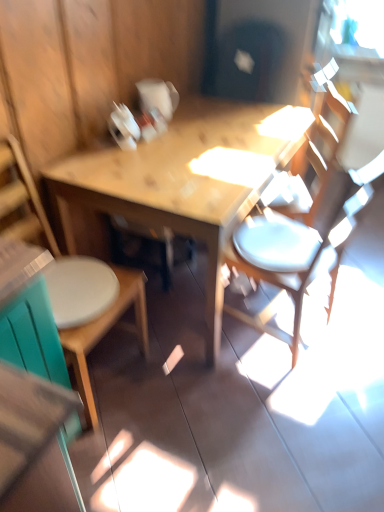
Identify the location of white matte chair at right, which ranks as the 2th chair in left-to-right order. (302, 249).

Locate an element on the screen. wooden chair at left, the second chair when ordered from right to left is located at coordinates (105, 333).

Locate an element on the screen. white matte chair at right, placed as the 1th chair when sorted from right to left is located at coordinates (302, 249).

From the image's perspective, who appears lower, wooden table at center or wooden chair at left, which is counted as the first chair, starting from the left?

wooden chair at left, which is counted as the first chair, starting from the left, is shown below in the image.

Is wooden table at center touching wooden chair at left, which is counted as the first chair, starting from the left?

They are not placed beside each other.

From the picture: Is wooden table at center in front of wooden chair at left, which is counted as the first chair, starting from the left?

No, wooden table at center is further to the viewer.

Based on the photo, is wooden table at center positioned with its back to wooden chair at left, which is counted as the first chair, starting from the left?

No.

Is white matte chair at right, which ranks as the 2th chair in left-to-right order, wider or thinner than wooden chair at left, which is counted as the first chair, starting from the left?

white matte chair at right, which ranks as the 2th chair in left-to-right order, is wider than wooden chair at left, which is counted as the first chair, starting from the left.

Would you consider white matte chair at right, which ranks as the 2th chair in left-to-right order, to be distant from wooden chair at left, the second chair when ordered from right to left?

No.

From a real-world perspective, is white matte chair at right, which ranks as the 2th chair in left-to-right order, physically above wooden chair at left, the second chair when ordered from right to left?

Incorrect, from a real-world perspective, white matte chair at right, which ranks as the 2th chair in left-to-right order, is lower than wooden chair at left, the second chair when ordered from right to left.

Is white matte chair at right, placed as the 1th chair when sorted from right to left, bigger than wooden chair at left, the second chair when ordered from right to left?

Yes.

In terms of width, does wooden chair at left, the second chair when ordered from right to left, look wider or thinner when compared to white matte chair at right, which ranks as the 2th chair in left-to-right order?

In the image, wooden chair at left, the second chair when ordered from right to left, appears to be more narrow than white matte chair at right, which ranks as the 2th chair in left-to-right order.

Is wooden chair at left, which is counted as the first chair, starting from the left, turned away from white matte chair at right, placed as the 1th chair when sorted from right to left?

No, wooden chair at left, which is counted as the first chair, starting from the left, is not facing away from white matte chair at right, placed as the 1th chair when sorted from right to left.

Find the location of a particular element. This screenshot has width=384, height=512. chair in front of the white matte chair at right, which ranks as the 2th chair in left-to-right order is located at coordinates (105, 333).

Considering the positions of points (88, 392) and (234, 168), is point (88, 392) farther from camera compared to point (234, 168)?

No.

Could you tell me if wooden chair at left, the second chair when ordered from right to left, is facing wooden table at center?

No, wooden chair at left, the second chair when ordered from right to left, is not turned towards wooden table at center.

How much distance is there between wooden chair at left, the second chair when ordered from right to left, and wooden table at center?

The distance of wooden chair at left, the second chair when ordered from right to left, from wooden table at center is 54.15 centimeters.

From a real-world perspective, count 2nd chairs upward from the wooden table at center and point to it. Please provide its 2D coordinates.

[(105, 333)]

From a real-world perspective, which object rests below the other?

wooden table at center, from a real-world perspective.

Do you think white matte chair at right, placed as the 1th chair when sorted from right to left, is within wooden table at center, or outside of it?

white matte chair at right, placed as the 1th chair when sorted from right to left, lies outside wooden table at center.

How many degrees apart are the facing directions of white matte chair at right, placed as the 1th chair when sorted from right to left, and wooden table at center?

167 degrees separate the facing orientations of white matte chair at right, placed as the 1th chair when sorted from right to left, and wooden table at center.

What are the coordinates of `table that appears behind the white matte chair at right, placed as the 1th chair when sorted from right to left` in the screenshot? It's located at (187, 180).

Would you say wooden table at center is to the left or to the right of white matte chair at right, which ranks as the 2th chair in left-to-right order, in the picture?

From the image, it's evident that wooden table at center is to the left of white matte chair at right, which ranks as the 2th chair in left-to-right order.

Which is closer to the camera, (x=213, y=298) or (x=320, y=205)?

Point (x=213, y=298) appears to be closer to the viewer than point (x=320, y=205).

From a real-world perspective, is wooden table at center physically below white matte chair at right, placed as the 1th chair when sorted from right to left?

Correct, in the physical world, wooden table at center is lower than white matte chair at right, placed as the 1th chair when sorted from right to left.

Is wooden table at center oriented away from white matte chair at right, placed as the 1th chair when sorted from right to left?

No.

Locate an element on the screen. table that is behind the wooden chair at left, which is counted as the first chair, starting from the left is located at coordinates (187, 180).

Locate an element on the screen. chair above the white matte chair at right, which ranks as the 2th chair in left-to-right order (from a real-world perspective) is located at coordinates (105, 333).

Looking at the image, which one is located further to wooden table at center, wooden chair at left, which is counted as the first chair, starting from the left, or white matte chair at right, placed as the 1th chair when sorted from right to left?

wooden chair at left, which is counted as the first chair, starting from the left, is positioned further to the anchor wooden table at center.

Estimate the real-world distances between objects in this image. Which object is further from white matte chair at right, which ranks as the 2th chair in left-to-right order, wooden table at center or wooden chair at left, which is counted as the first chair, starting from the left?

The object further to white matte chair at right, which ranks as the 2th chair in left-to-right order, is wooden chair at left, which is counted as the first chair, starting from the left.

Looking at this image, looking at the image, which one is located closer to wooden chair at left, the second chair when ordered from right to left, wooden table at center or white matte chair at right, placed as the 1th chair when sorted from right to left?

Based on the image, wooden table at center appears to be nearer to wooden chair at left, the second chair when ordered from right to left.

Looking at the image, which one is located further to wooden table at center, white matte chair at right, which ranks as the 2th chair in left-to-right order, or wooden chair at left, the second chair when ordered from right to left?

Among the two, wooden chair at left, the second chair when ordered from right to left, is located further to wooden table at center.

When comparing their distances from wooden chair at left, which is counted as the first chair, starting from the left, does white matte chair at right, which ranks as the 2th chair in left-to-right order, or wooden table at center seem further?

The object further to wooden chair at left, which is counted as the first chair, starting from the left, is white matte chair at right, which ranks as the 2th chair in left-to-right order.

Looking at this image, based on their spatial positions, is wooden chair at left, which is counted as the first chair, starting from the left, or wooden table at center closer to white matte chair at right, placed as the 1th chair when sorted from right to left?

Among the two, wooden table at center is located nearer to white matte chair at right, placed as the 1th chair when sorted from right to left.

This screenshot has width=384, height=512. Find the location of `table located between wooden chair at left, which is counted as the first chair, starting from the left, and white matte chair at right, placed as the 1th chair when sorted from right to left, in the left-right direction`. table located between wooden chair at left, which is counted as the first chair, starting from the left, and white matte chair at right, placed as the 1th chair when sorted from right to left, in the left-right direction is located at coordinates (187, 180).